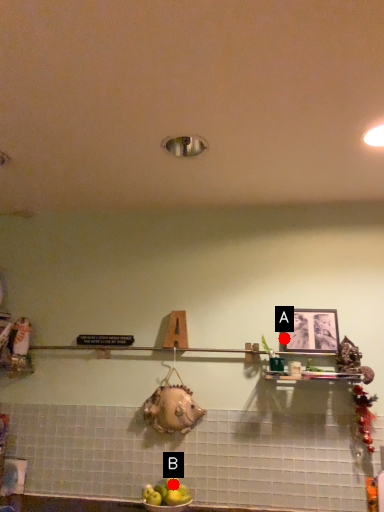
Question: Two points are circled on the image, labeled by A and B beside each circle. Which point is closer to the camera?

Choices:
 (A) A is closer
 (B) B is closer

Answer: (B)